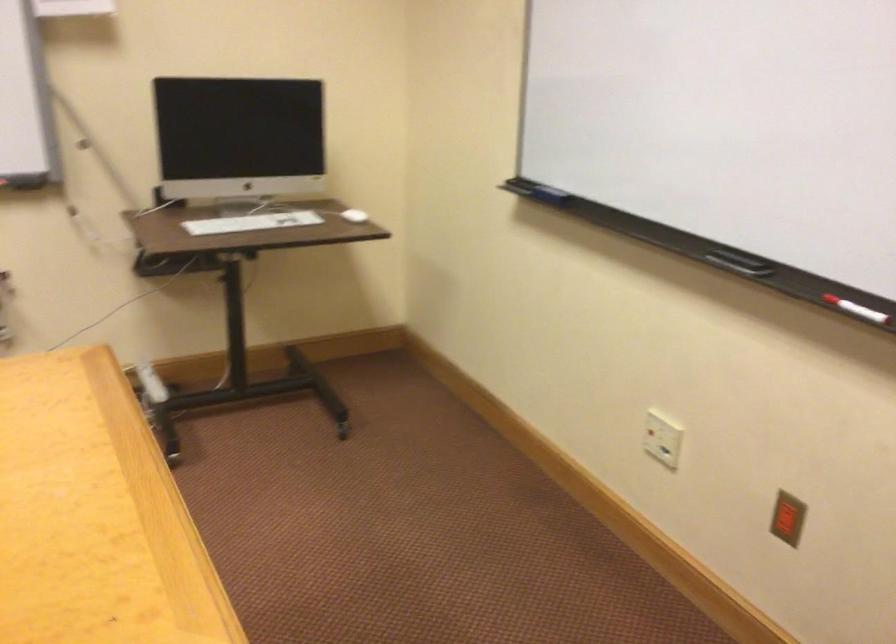
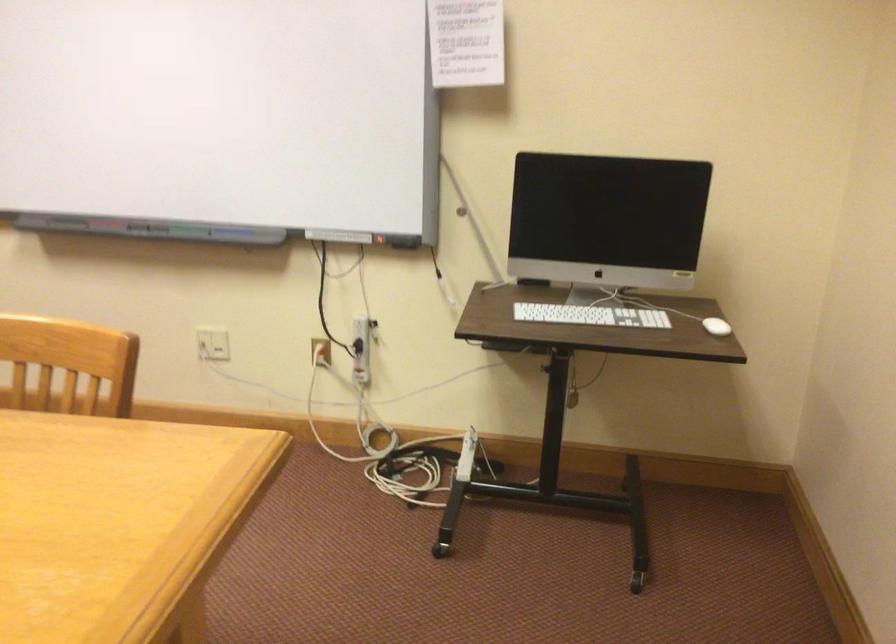
Locate, in the second image, the point that corresponds to (x=362, y=214) in the first image.

(716, 326)